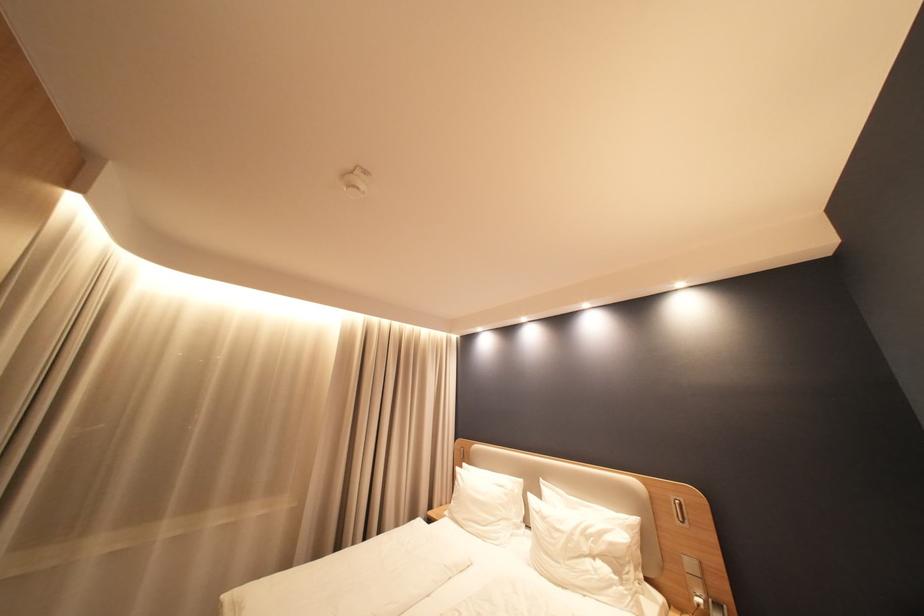
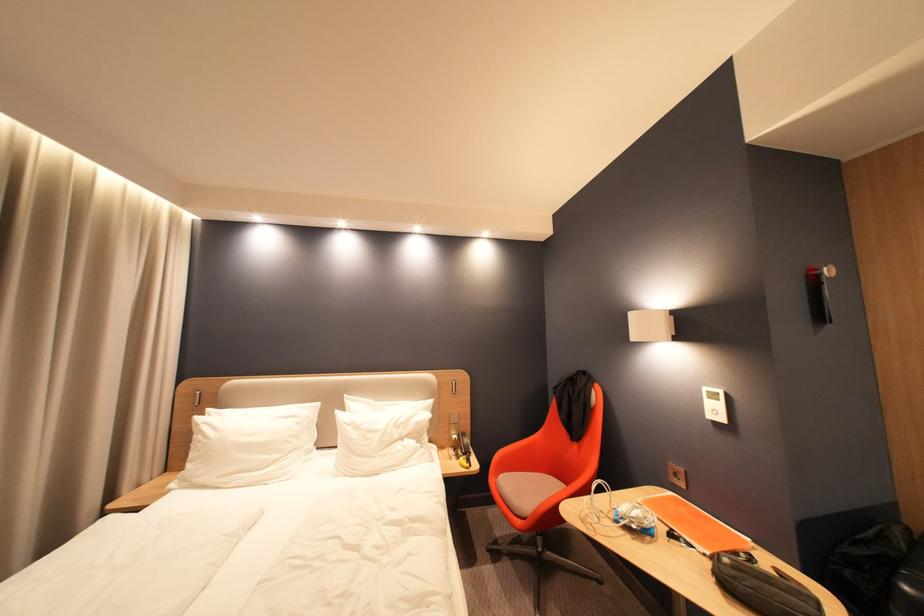
Question: The camera is either moving clockwise (left) or counter-clockwise (right) around the object. The first image is from the beginning of the video and the second image is from the end. Is the camera moving left or right when shooting the video?

Choices:
 (A) Left
 (B) Right

Answer: (A)